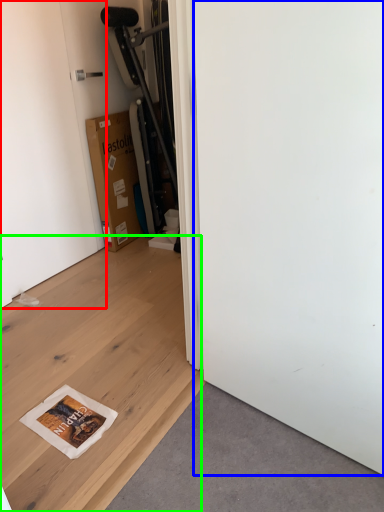
Question: Which object is the closest to the door (highlighted by a red box)? Choose among these: screen door (highlighted by a blue box) or plywood (highlighted by a green box).

Choices:
 (A) screen door
 (B) plywood

Answer: (B)